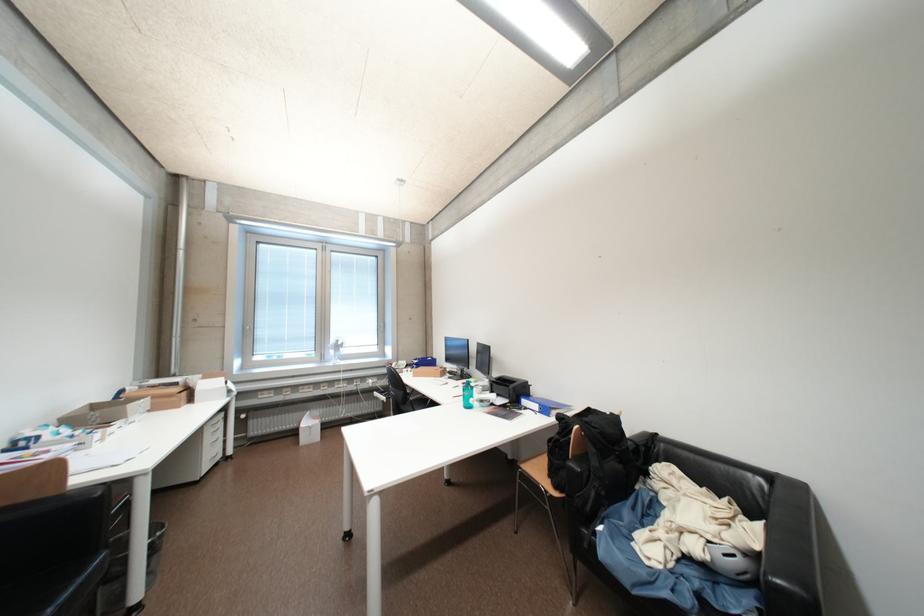
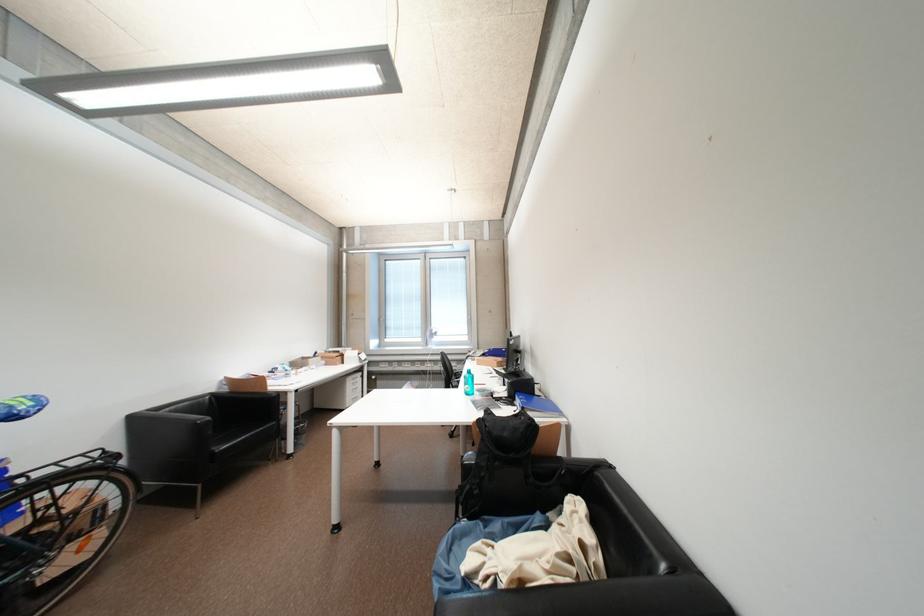
Locate, in the second image, the point that corresponds to [266,322] in the first image.

(395, 315)